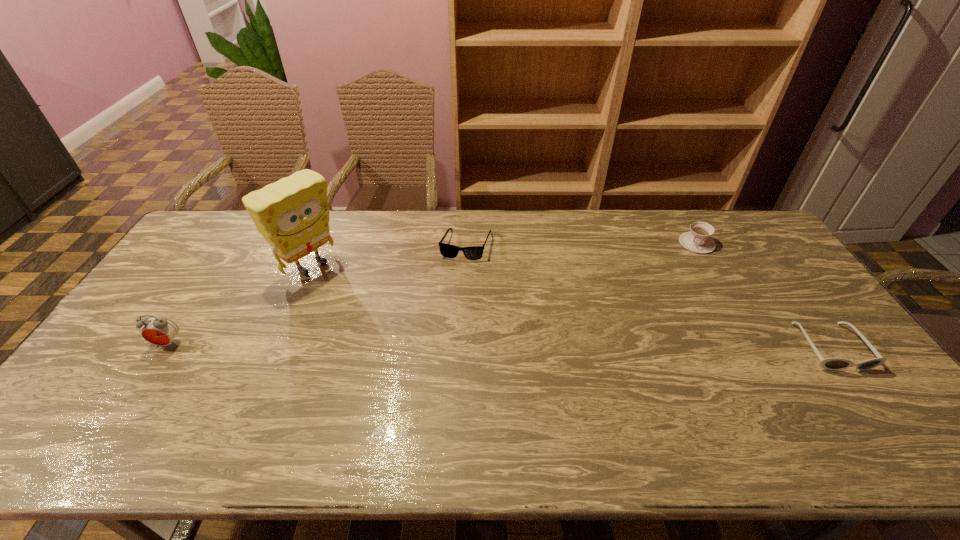
You are a GUI agent. You are given a task and a screenshot of the screen. Output one action in this format:
    pyautogui.click(x=<x>, y=<y>)
    Task: Click on the free space located 0.090m with the lenses of the nearer sunglasses facing outward
    The width and height of the screenshot is (960, 540).
    Given the screenshot: What is the action you would take?
    pyautogui.click(x=872, y=404)

Identify the location of vacant point located on the front-facing side of the third object from right to left. The image size is (960, 540). (448, 316).

This screenshot has width=960, height=540. Find the location of `free space located on the front-facing side of the third object from right to left`. free space located on the front-facing side of the third object from right to left is located at coordinates (446, 323).

You are a GUI agent. You are given a task and a screenshot of the screen. Output one action in this format:
    pyautogui.click(x=<x>, y=<y>)
    Task: Click on the vacant area located on the front-facing side of the third object from right to left
    The height and width of the screenshot is (540, 960).
    Given the screenshot: What is the action you would take?
    pyautogui.click(x=442, y=343)

Identify the location of vacant region located 0.360m on the face of the tallest object. The height and width of the screenshot is (540, 960). (409, 338).

Locate an element on the screen. free point located on the face of the tallest object is located at coordinates (377, 315).

Where is `vacant space located on the face of the tallest object`? The image size is (960, 540). vacant space located on the face of the tallest object is located at coordinates (392, 325).

You are a GUI agent. You are given a task and a screenshot of the screen. Output one action in this format:
    pyautogui.click(x=<x>, y=<y>)
    Task: Click on the vacant space located 0.080m on the handle side of the teacup
    
    Given the screenshot: What is the action you would take?
    pyautogui.click(x=679, y=262)

At what (x,y) coordinates should I click in order to perform the action: click on vacant space located on the handle side of the teacup. Please return your answer as a coordinate pair (x, y). This screenshot has width=960, height=540. Looking at the image, I should click on [667, 274].

The image size is (960, 540). What are the coordinates of `vacant position located on the handle side of the teacup` in the screenshot? It's located at pos(638,303).